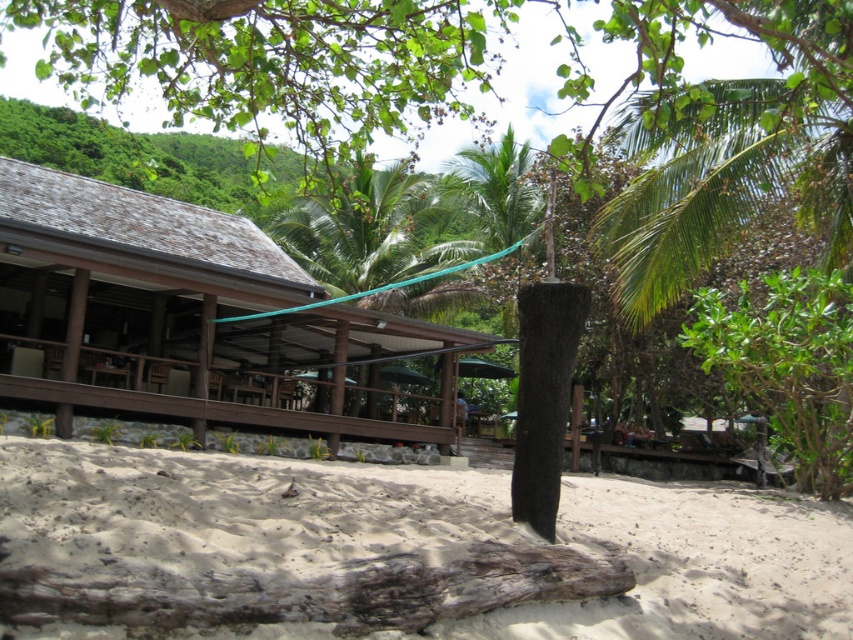
You are standing at the point marked as point (x=418, y=547) on the beach. What is the color of the ground beneath your feet?

The ground beneath your feet at point (x=418, y=547) is light brown sandy beach at center.